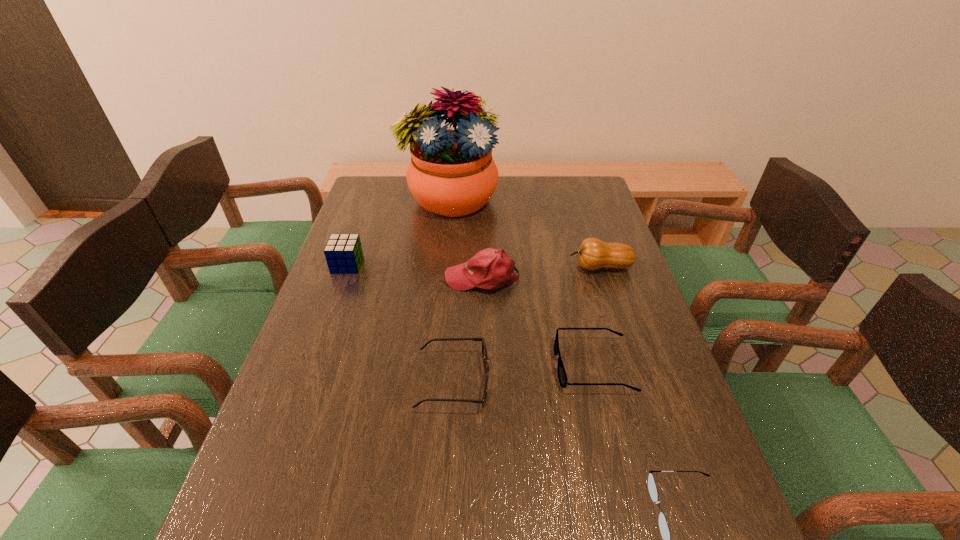
You are a GUI agent. You are given a task and a screenshot of the screen. Output one action in this format:
    pyautogui.click(x=<x>, y=<y>)
    Task: Click on the free space located at the front of the baseball cap with the brim
    Image resolution: width=960 pixels, height=540 pixels.
    Given the screenshot: What is the action you would take?
    pyautogui.click(x=399, y=278)

In order to click on vacant position located on the stem side of the gourd in this screenshot , I will do `click(518, 267)`.

The image size is (960, 540). In order to click on free region located 0.200m on the stem side of the gourd in this screenshot , I will do `click(502, 267)`.

I want to click on free space located 0.290m on the stem side of the gourd, so click(x=471, y=267).

Find the location of `vacant space located on the front of the fourth shortest object`. vacant space located on the front of the fourth shortest object is located at coordinates (316, 354).

Where is `vacant space located 0.200m on the front-facing side of the leftmost spectacles`? The height and width of the screenshot is (540, 960). vacant space located 0.200m on the front-facing side of the leftmost spectacles is located at coordinates (576, 382).

The image size is (960, 540). I want to click on object positioned at the far edge, so click(x=452, y=173).

You are a GUI agent. You are given a task and a screenshot of the screen. Output one action in this format:
    pyautogui.click(x=<x>, y=<y>)
    Task: Click on the flower arrangement at the left edge
    Image resolution: width=960 pixels, height=540 pixels.
    Given the screenshot: What is the action you would take?
    pyautogui.click(x=452, y=173)

Where is `cube at the left edge`? cube at the left edge is located at coordinates (343, 252).

Identify the location of gourd that is at the right edge. The width and height of the screenshot is (960, 540). (593, 254).